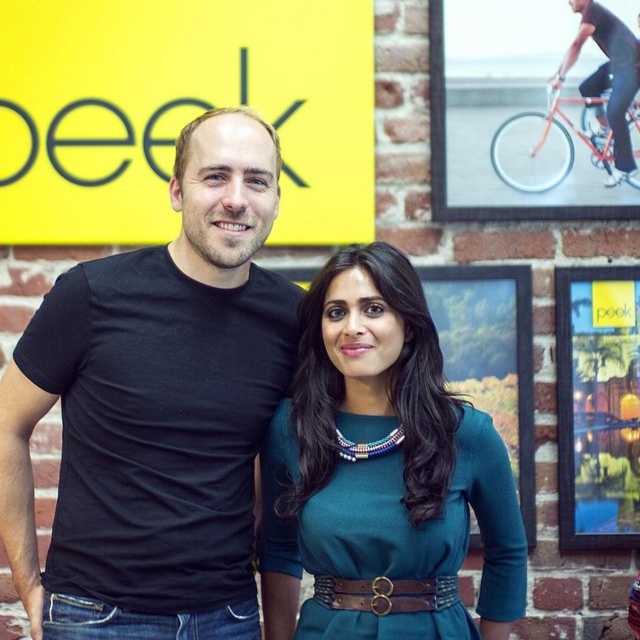
You are standing in front of the brick wall with two people. You want to take a photo of the point at coordinates (x=442, y=280). Is the point within your camera frame if your camera has a focal length of 50mm and the sensor size is 24mm x 36mm?

The point at coordinates (x=442, y=280) is 6.03 meters from the camera. Using the camera specifications, the distance of 6.03 meters would place the point within the camera frame as the focal length and sensor size allow for capturing objects at that distance.

You are a photographer adjusting your camera settings to capture a clear image of both the matte black picture frame at center and the brown leather belt at center. Which object should you focus on first to ensure both are in sharp focus?

You should focus on the matte black picture frame at center first since it is closer to you than the brown leather belt at center, ensuring both will be in focus when using a shallow depth of field.